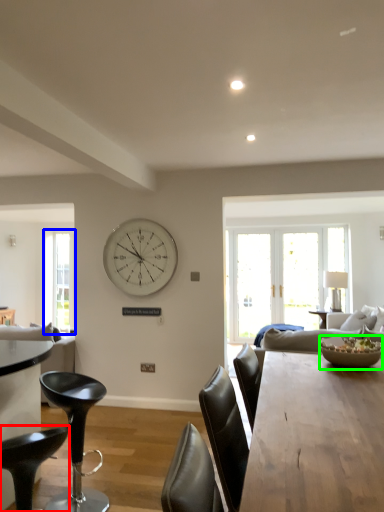
Question: Considering the real-world distances, which object is closest to chair (highlighted by a red box)? window (highlighted by a blue box) or bowl (highlighted by a green box).

Choices:
 (A) window
 (B) bowl

Answer: (B)